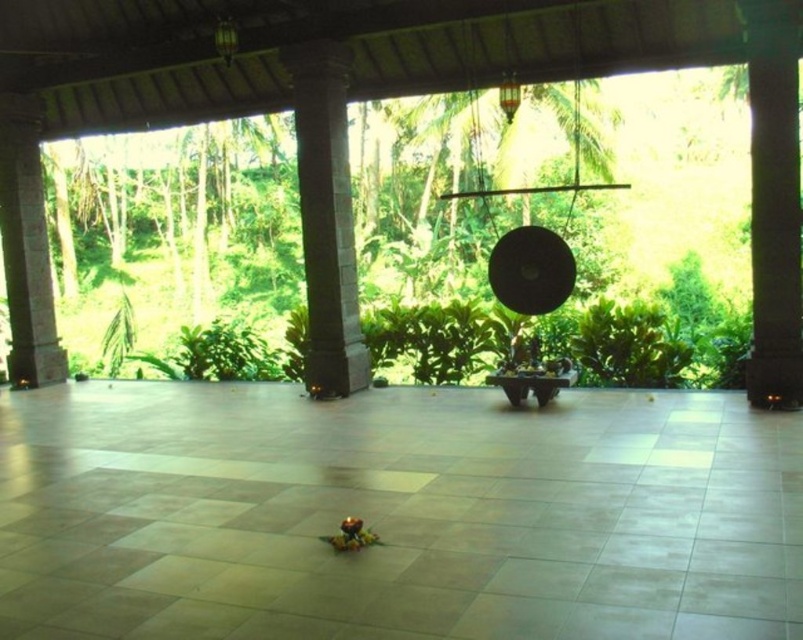
Question: Among these points, which one is nearest to the camera?

Choices:
 (A) (764, 301)
 (B) (336, 356)
 (C) (9, 122)

Answer: (A)

Question: Does gray stone pillar at center come in front of brown stone pillar at left?

Choices:
 (A) yes
 (B) no

Answer: (A)

Question: Among these objects, which one is nearest to the camera?

Choices:
 (A) gray stone pillar at center
 (B) brown stone pillar at left
 (C) dark gray stone pillar at right

Answer: (C)

Question: Is dark gray stone pillar at right smaller than brown stone pillar at left?

Choices:
 (A) no
 (B) yes

Answer: (B)

Question: Is dark gray stone pillar at right further to camera compared to brown stone pillar at left?

Choices:
 (A) yes
 (B) no

Answer: (B)

Question: Which object is the closest to the dark gray stone pillar at right?

Choices:
 (A) brown stone pillar at left
 (B) gray stone pillar at center

Answer: (B)